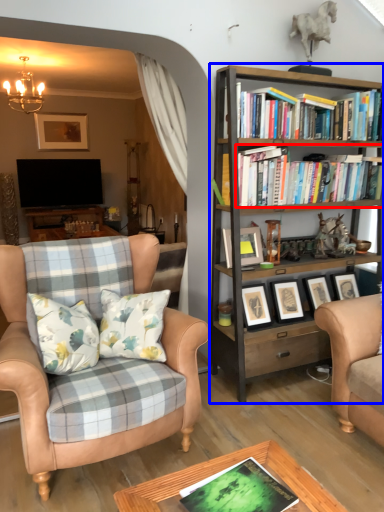
Question: Which of the following is the closest to the observer, book (highlighted by a red box) or bookcase (highlighted by a blue box)?

Choices:
 (A) book
 (B) bookcase

Answer: (B)